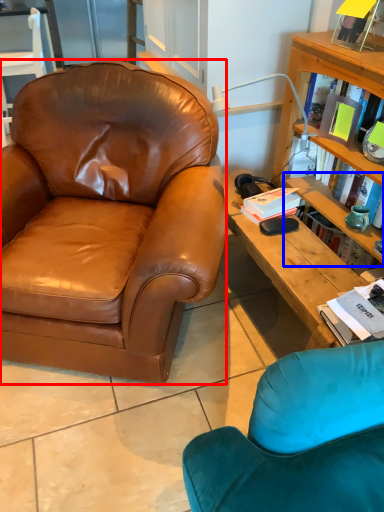
Question: Which object appears farthest to the camera in this image, chair (highlighted by a red box) or shelf (highlighted by a blue box)?

Choices:
 (A) chair
 (B) shelf

Answer: (B)